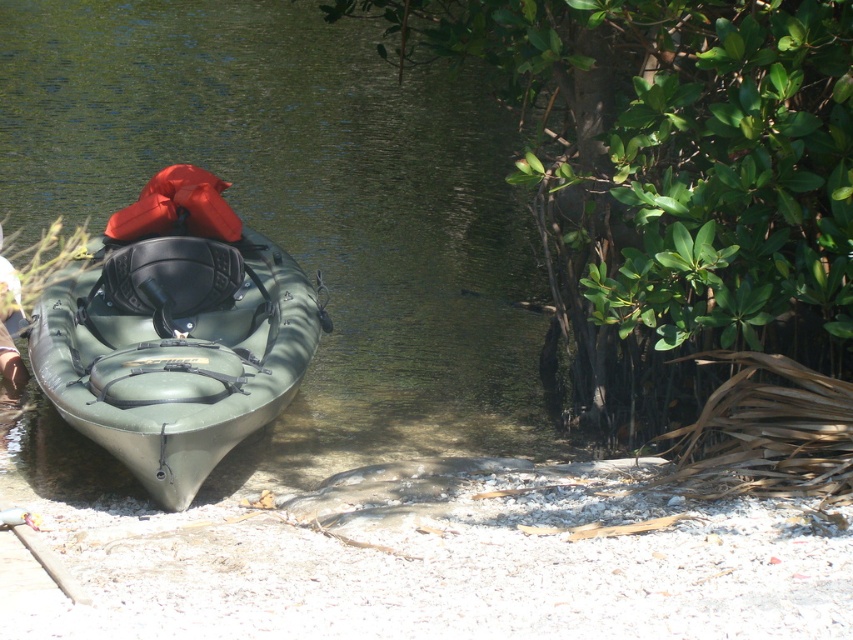
You are standing at the camera position and want to reach the green rubber kayak at center to retrieve your keys. The path to the kayak is clear except for a small rocky area that is 28 feet away from the camera. Will you be able to reach the kayak without stepping on the rocks?

The green rubber kayak at center is 31.16 feet from the camera. Since the rocky area is only 28 feet away, you can walk past the rocks and continue 3.16 more feet to reach the kayak without stepping on them.

You are standing on the sandy shore and want to board the green rubber kayak at center. Which direction should you walk from the matte green kayak at center to reach it?

The green rubber kayak at center is positioned on the left side of the matte green kayak at center, so you should walk to the left to reach it.

You are planning to store the green rubber kayak at center and the matte green kayak at center in a storage shed. The shed has two slots, one that can fit a wider kayak and another for a narrower one. Which kayak should go into the wider slot?

The green rubber kayak at center should go into the wider slot because its width surpasses that of the matte green kayak at center.